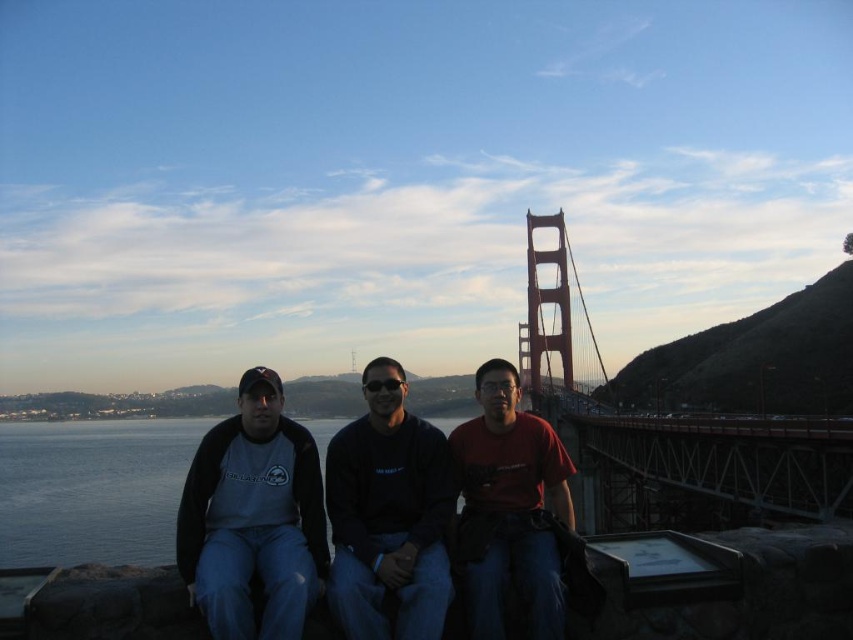
You are standing at the viewpoint looking at the bridge. There are two points marked on the bridge structure. Which point, point (534, 572) or point (630, 435), is closer to you?

Point (534, 572) is closer to the viewer than point (630, 435).

You are a photographer planning to take a group photo of the matte gray sweatshirt at left and the metallic steel bridge at center. Since the bridge is a key landmark, you want to ensure it appears larger in the photo than the sweatshirt. Based on the scene description, is this possible? Please explain.

The matte gray sweatshirt at left is much taller than the metallic steel bridge at center. Therefore, it would be challenging to make the bridge appear larger in the photo than the sweatshirt as it is described to be smaller in height.